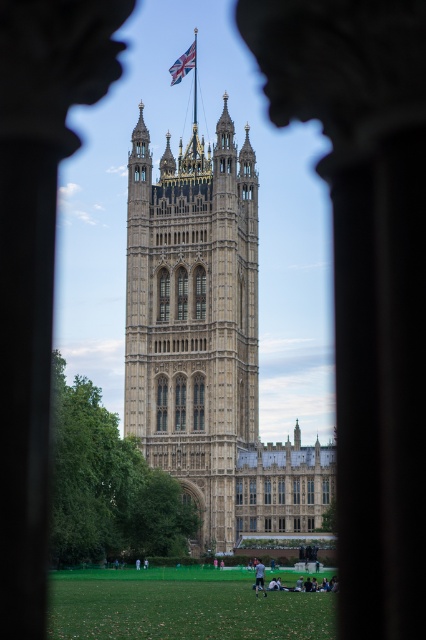
You are a tourist standing in front of the Palace of Westminster. You notice the beige stone tower at center and the union jack fabric at upper center. Which object is wider?

The beige stone tower at center is wider than the union jack fabric at upper center.

You are standing in the courtyard of the Palace of Westminster. You see the beige stone tower at center and the union jack fabric at upper center. Which object is closer to you?

The beige stone tower at center is closer to the viewer than the union jack fabric at upper center.